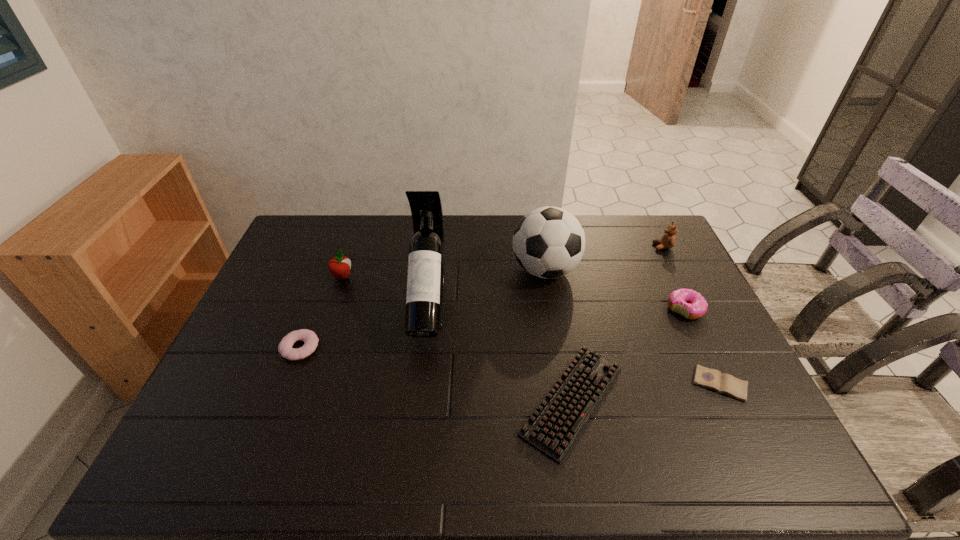
Identify the location of the sixth object from right to left. (426, 265).

Locate an element on the screen. wine bottle is located at coordinates (426, 265).

This screenshot has width=960, height=540. What are the coordinates of `soccer ball` in the screenshot? It's located at (549, 242).

Identify the location of teddy bear. This screenshot has width=960, height=540. coord(668,240).

This screenshot has width=960, height=540. I want to click on apple, so (x=339, y=266).

At what (x,y) coordinates should I click in order to perform the action: click on the farther doughnut. Please return your answer as a coordinate pair (x, y). Image resolution: width=960 pixels, height=540 pixels. Looking at the image, I should click on (692, 305).

The height and width of the screenshot is (540, 960). I want to click on the right doughnut, so click(692, 305).

The image size is (960, 540). Identify the location of the nearer doughnut. (310, 339).

Find the location of `the third shortest object`. the third shortest object is located at coordinates (310, 339).

Where is `computer keyboard`? computer keyboard is located at coordinates (553, 427).